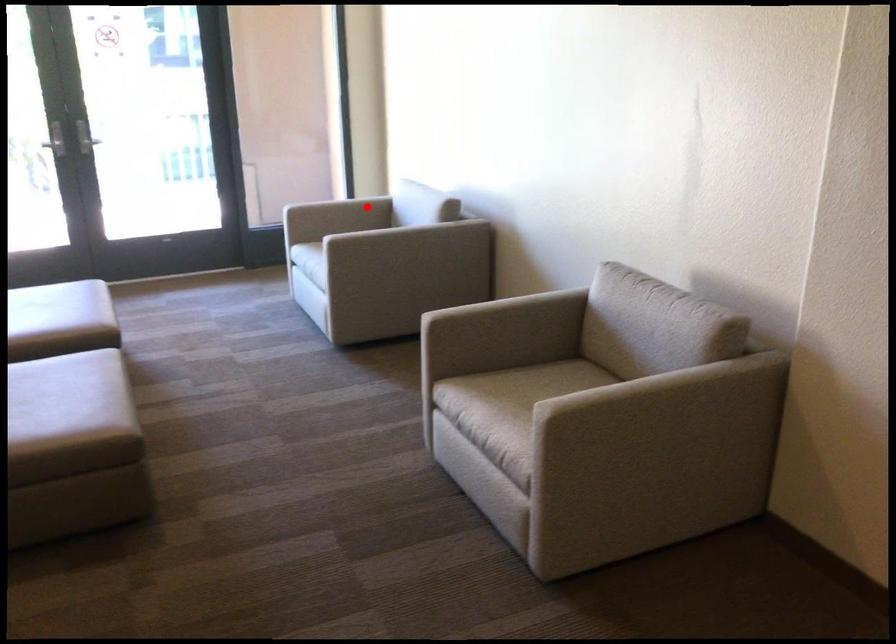
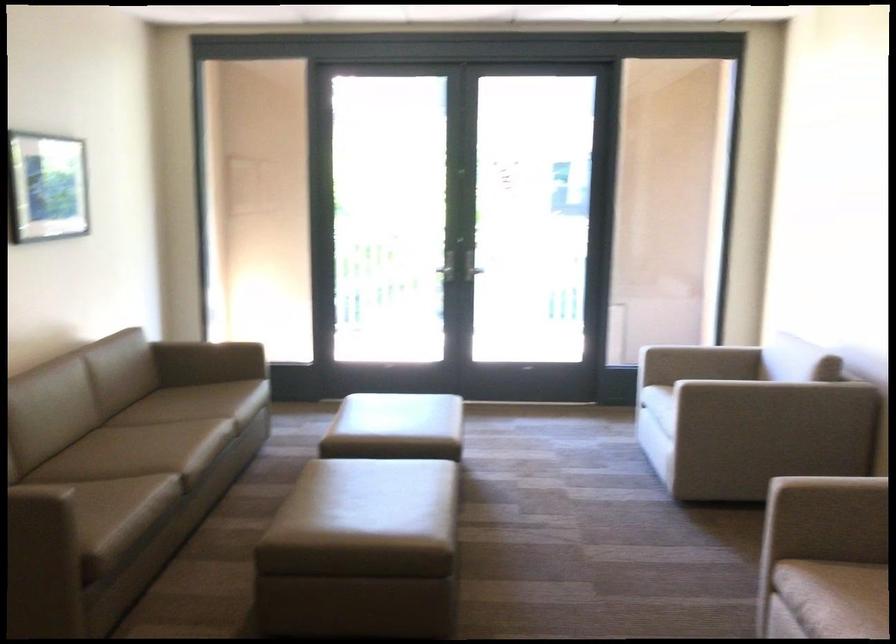
In the second image, find the point that corresponds to the highlighted location in the first image.

(734, 363)